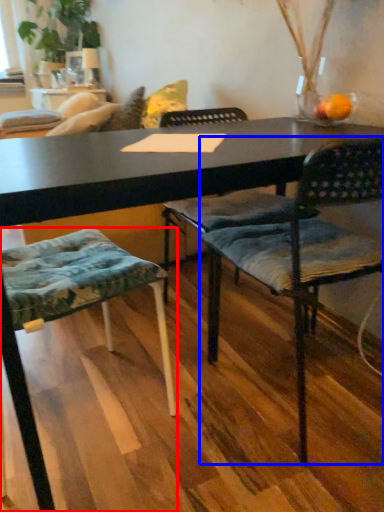
Question: Among these objects, which one is farthest to the camera, chair (highlighted by a red box) or chair (highlighted by a blue box)?

Choices:
 (A) chair
 (B) chair

Answer: (B)